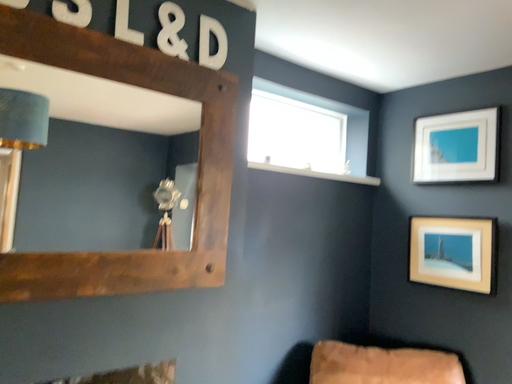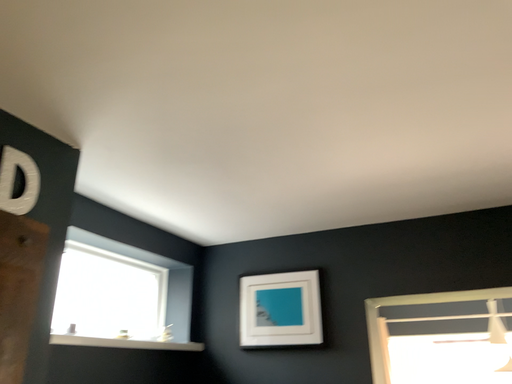
Question: Which way did the camera rotate in the video?

Choices:
 (A) rotated downward
 (B) rotated upward

Answer: (B)